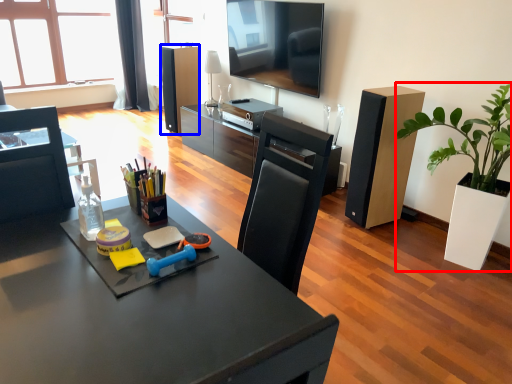
Question: Which of the following is the closest to the observer, houseplant (highlighted by a red box) or speaker (highlighted by a blue box)?

Choices:
 (A) houseplant
 (B) speaker

Answer: (A)